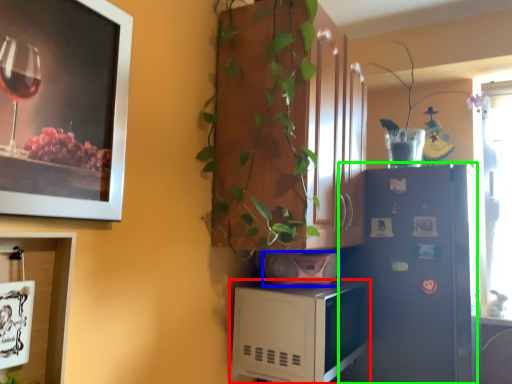
Question: Estimate the real-world distances between objects in this image. Which object is closer to microwave oven (highlighted by a red box), appliance (highlighted by a blue box) or refrigerator (highlighted by a green box)?

Choices:
 (A) appliance
 (B) refrigerator

Answer: (A)